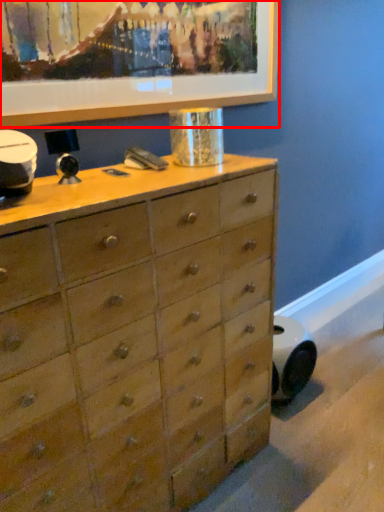
Question: From the image's perspective, considering the relative positions of picture frame (annotated by the red box) and chest of drawers in the image provided, where is picture frame (annotated by the red box) located with respect to the staircase?

Choices:
 (A) above
 (B) below

Answer: (A)